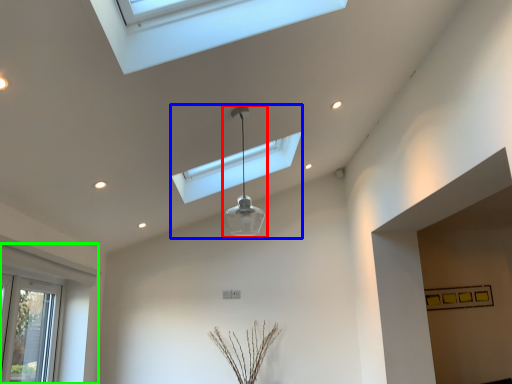
Question: Based on their relative distances, which object is nearer to lamp (highlighted by a red box)? Choose from lamp (highlighted by a blue box) and window (highlighted by a green box).

Choices:
 (A) lamp
 (B) window

Answer: (A)